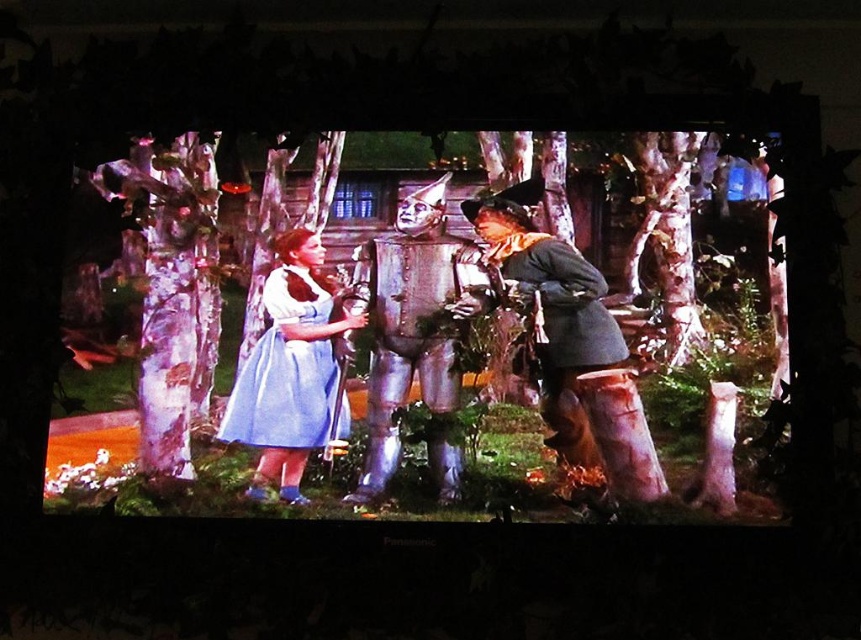
In the scene from The Wizard of Oz, you see the rusty metal man at center and the light blue satin dress at center. Which object takes up more space in the image?

The rusty metal man at center is bigger than the light blue satin dress at center, so it takes up more space in the image.

In the scene from The Wizard of Oz, you see a metallic silver robot at center and a light blue satin dress at center. Which object takes up more space in the image?

The metallic silver robot at center is larger in size than the light blue satin dress at center, so it takes up more space in the image.